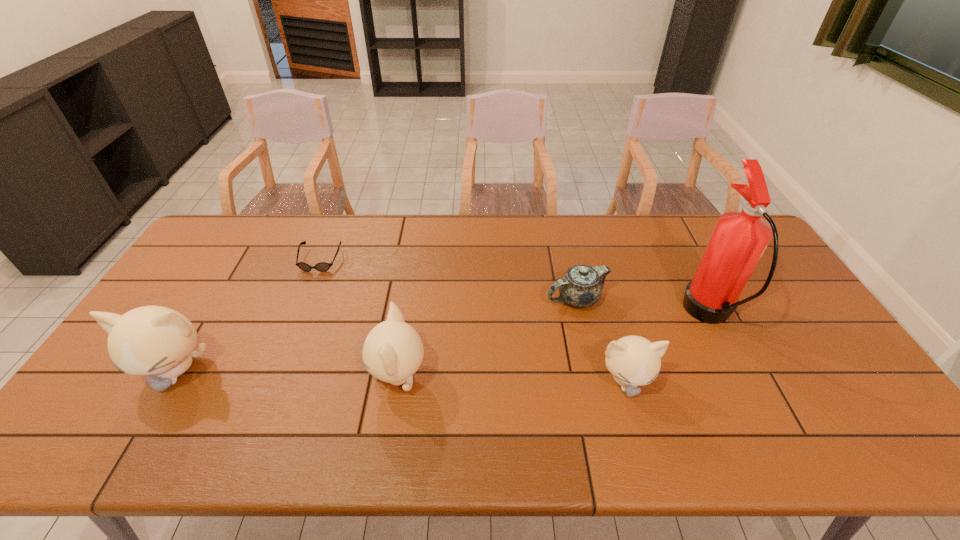
Considering the uniform spacing of kittens, where should an additional kitten be positioned on the right? Please locate a free spot. Please provide its 2D coordinates. Your answer should be formatted as a tuple, i.e. [(x, y)], where the tuple contains the x and y coordinates of a point satisfying the conditions above.

[(858, 387)]